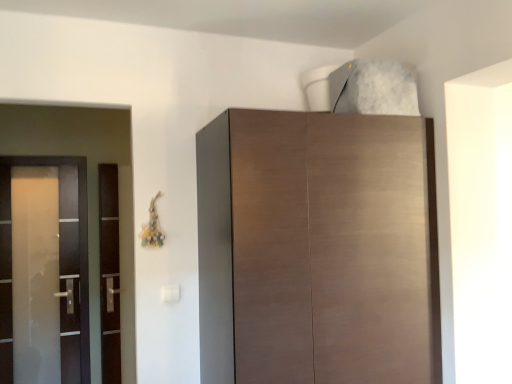
Question: Is transparent glass door at left, which is the 1th screen door in right-to-left order, further to the viewer compared to matte brown cabinet at upper center?

Choices:
 (A) yes
 (B) no

Answer: (A)

Question: Can you confirm if transparent glass door at left, which is counted as the 2th screen door, starting from the left, is wider than matte brown cabinet at upper center?

Choices:
 (A) yes
 (B) no

Answer: (B)

Question: Is transparent glass door at left, which is the 1th screen door in right-to-left order, facing away from matte brown cabinet at upper center?

Choices:
 (A) no
 (B) yes

Answer: (A)

Question: From a real-world perspective, is transparent glass door at left, which is counted as the 2th screen door, starting from the left, located beneath matte brown cabinet at upper center?

Choices:
 (A) yes
 (B) no

Answer: (A)

Question: Considering the relative sizes of transparent glass door at left, which is counted as the 2th screen door, starting from the left, and matte brown cabinet at upper center in the image provided, is transparent glass door at left, which is counted as the 2th screen door, starting from the left, thinner than matte brown cabinet at upper center?

Choices:
 (A) no
 (B) yes

Answer: (B)

Question: Considering the positions of satin glass screen door at left, marked as the 2th screen door in a right-to-left arrangement, and matte brown cabinet at upper center in the image, is satin glass screen door at left, marked as the 2th screen door in a right-to-left arrangement, taller or shorter than matte brown cabinet at upper center?

Choices:
 (A) short
 (B) tall

Answer: (B)

Question: Is point (58, 357) positioned closer to the camera than point (244, 135)?

Choices:
 (A) closer
 (B) farther

Answer: (B)

Question: From the image's perspective, is satin glass screen door at left, positioned as the first screen door in left-to-right order, located above or below matte brown cabinet at upper center?

Choices:
 (A) above
 (B) below

Answer: (B)

Question: Considering their positions, is satin glass screen door at left, positioned as the first screen door in left-to-right order, located in front of or behind matte brown cabinet at upper center?

Choices:
 (A) behind
 (B) front

Answer: (A)

Question: From the image's perspective, is matte brown cabinet at upper center above or below transparent glass door at left, which is counted as the 2th screen door, starting from the left?

Choices:
 (A) above
 (B) below

Answer: (A)

Question: Is matte brown cabinet at upper center taller or shorter than transparent glass door at left, which is counted as the 2th screen door, starting from the left?

Choices:
 (A) tall
 (B) short

Answer: (B)

Question: Does point (394, 271) appear closer or farther from the camera than point (105, 168)?

Choices:
 (A) closer
 (B) farther

Answer: (A)

Question: Considering the positions of matte brown cabinet at upper center and transparent glass door at left, which is the 1th screen door in right-to-left order, in the image, is matte brown cabinet at upper center wider or thinner than transparent glass door at left, which is the 1th screen door in right-to-left order,?

Choices:
 (A) wide
 (B) thin

Answer: (A)

Question: In the image, is matte brown cabinet at upper center positioned in front of or behind satin glass screen door at left, positioned as the first screen door in left-to-right order?

Choices:
 (A) behind
 (B) front

Answer: (B)

Question: From their relative heights in the image, would you say matte brown cabinet at upper center is taller or shorter than satin glass screen door at left, positioned as the first screen door in left-to-right order?

Choices:
 (A) tall
 (B) short

Answer: (B)